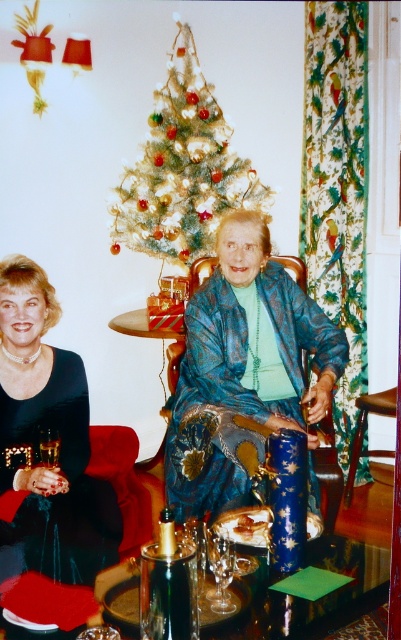
What is the position of the point labeled as (243, 365) in relation to the blue textured dress at center?

The point labeled as (243, 365) is located on the blue textured dress at center.

You are standing in the festive scene and want to find the blue textured dress at center. According to the coordinates provided, where should you look relative to the other objects in the scene?

A: The blue textured dress at center is located at point coordinates, so you should look towards the center of the scene to find it.